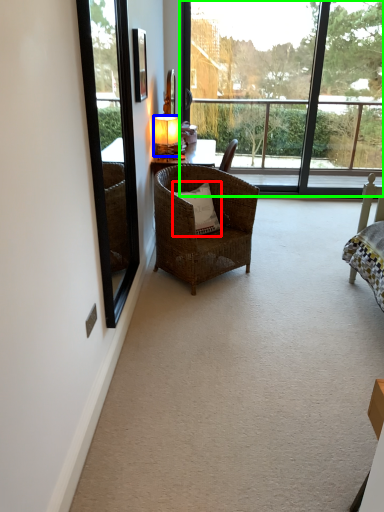
Question: Which object is the farthest from pillow (highlighted by a red box)? Choose among these: lamp (highlighted by a blue box) or window (highlighted by a green box).

Choices:
 (A) lamp
 (B) window

Answer: (B)